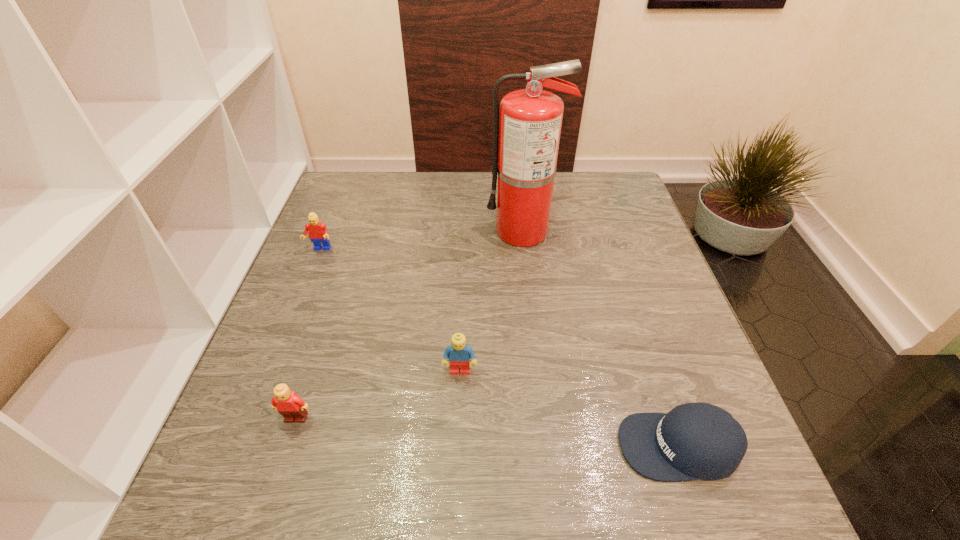
Identify the location of object situated at the near edge. (699, 440).

This screenshot has width=960, height=540. I want to click on object at the right edge, so click(699, 440).

Identify the location of object that is positioned at the near right corner. (699, 440).

Identify the location of free point at the far edge. (463, 172).

In the image, there is a desktop. Identify the location of vacant space at the near edge. The height and width of the screenshot is (540, 960). (418, 516).

The height and width of the screenshot is (540, 960). In the image, there is a desktop. Find the location of `free space at the left edge`. free space at the left edge is located at coordinates (294, 273).

This screenshot has height=540, width=960. I want to click on vacant point at the right edge, so click(x=639, y=305).

In the image, there is a desktop. Where is `vacant space at the far left corner`? This screenshot has width=960, height=540. vacant space at the far left corner is located at coordinates (372, 212).

Find the location of a particular element. free region at the far right corner of the desktop is located at coordinates pyautogui.click(x=628, y=187).

Where is `unoccupied area between the leftmost object and the rightmost Lego`? unoccupied area between the leftmost object and the rightmost Lego is located at coordinates (390, 310).